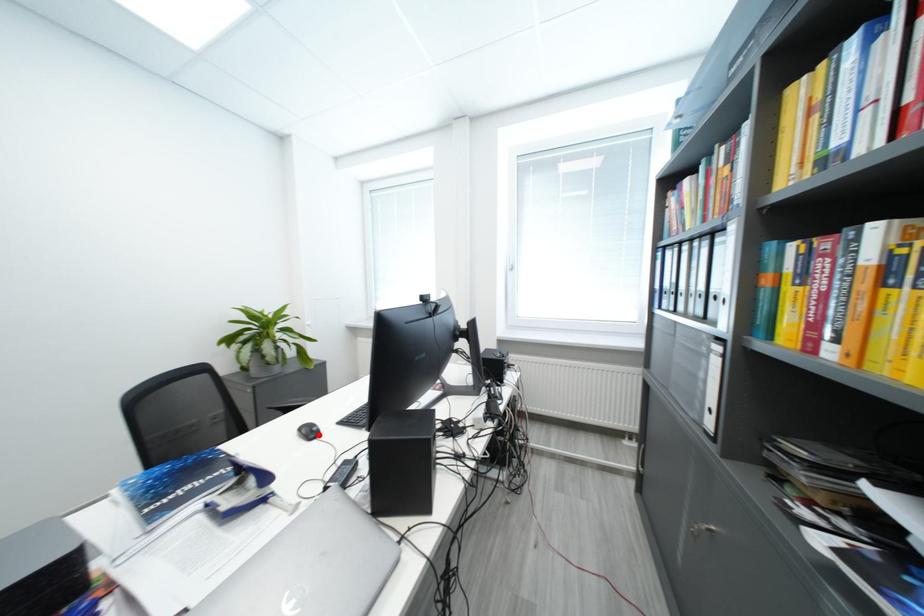
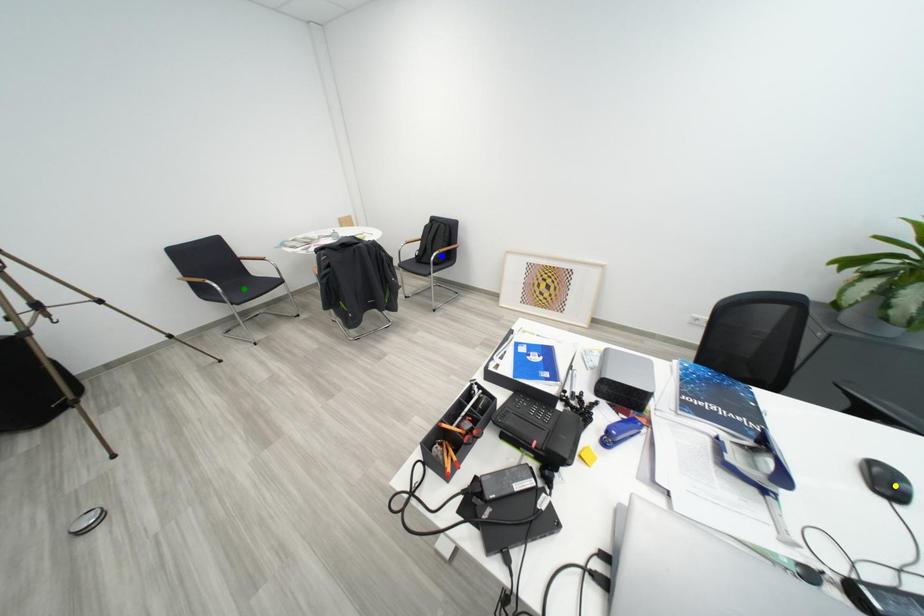
Question: I am providing you with two images of the same scene from different viewpoints. A red point is marked on the first image. You are given multiple points on the second image. Which spot in image 2 lines up with the point in image 1?

Choices:
 (A) yellow point
 (B) green point
 (C) blue point

Answer: (A)